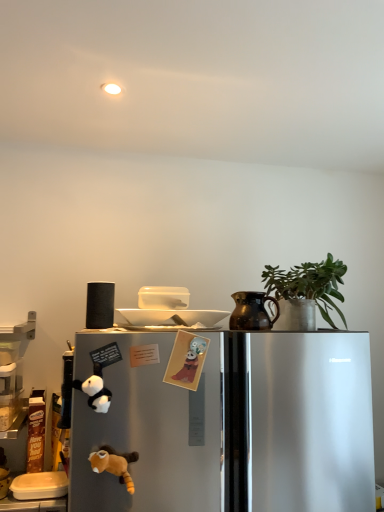
Question: Does green matte plant at upper right come in front of brown matte jug at upper right?

Choices:
 (A) no
 (B) yes

Answer: (B)

Question: Is green matte plant at upper right at the right side of brown matte jug at upper right?

Choices:
 (A) no
 (B) yes

Answer: (B)

Question: From a real-world perspective, is green matte plant at upper right physically above brown matte jug at upper right?

Choices:
 (A) yes
 (B) no

Answer: (A)

Question: Is green matte plant at upper right positioned behind brown matte jug at upper right?

Choices:
 (A) yes
 (B) no

Answer: (B)

Question: Is green matte plant at upper right shorter than brown matte jug at upper right?

Choices:
 (A) no
 (B) yes

Answer: (A)

Question: Is there a large distance between green matte plant at upper right and brown matte jug at upper right?

Choices:
 (A) no
 (B) yes

Answer: (A)

Question: Is orange plush toy at lower left taller than white plastic container at lower left?

Choices:
 (A) no
 (B) yes

Answer: (B)

Question: Is orange plush toy at lower left far from white plastic container at lower left?

Choices:
 (A) yes
 (B) no

Answer: (B)

Question: Does orange plush toy at lower left contain white plastic container at lower left?

Choices:
 (A) yes
 (B) no

Answer: (B)

Question: Can you confirm if orange plush toy at lower left is thinner than white plastic container at lower left?

Choices:
 (A) no
 (B) yes

Answer: (B)

Question: Is orange plush toy at lower left smaller than white plastic container at lower left?

Choices:
 (A) yes
 (B) no

Answer: (A)

Question: Could you tell me if orange plush toy at lower left is turned towards white plastic container at lower left?

Choices:
 (A) no
 (B) yes

Answer: (A)

Question: Is green matte plant at upper right shorter than orange plush toy at lower left?

Choices:
 (A) no
 (B) yes

Answer: (A)